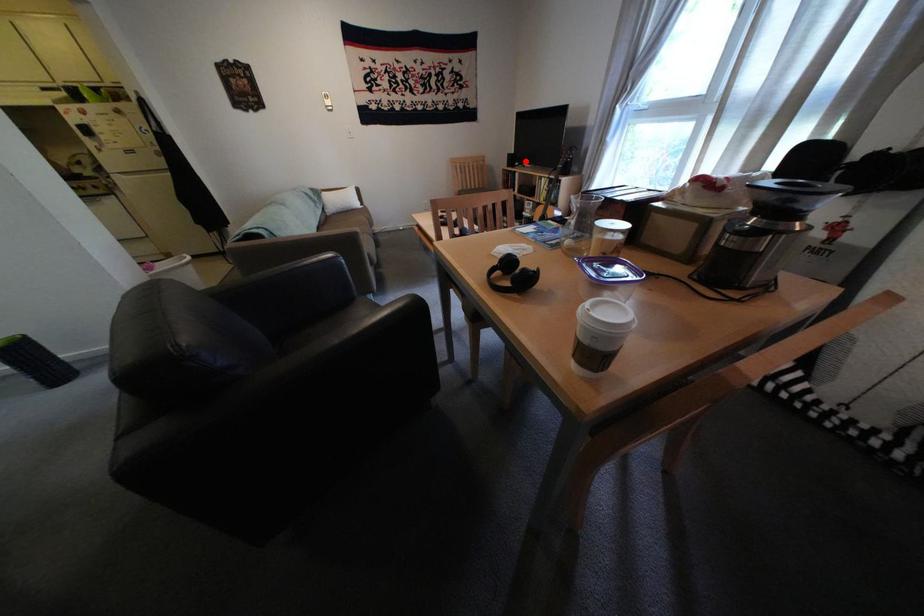
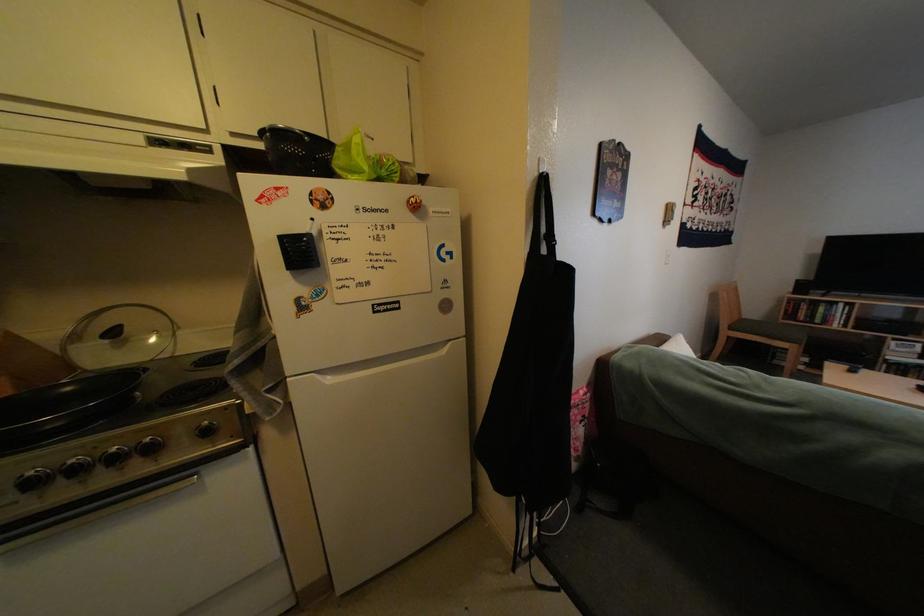
In the second image, find the point that corresponds to the highlighted location in the first image.

(816, 288)